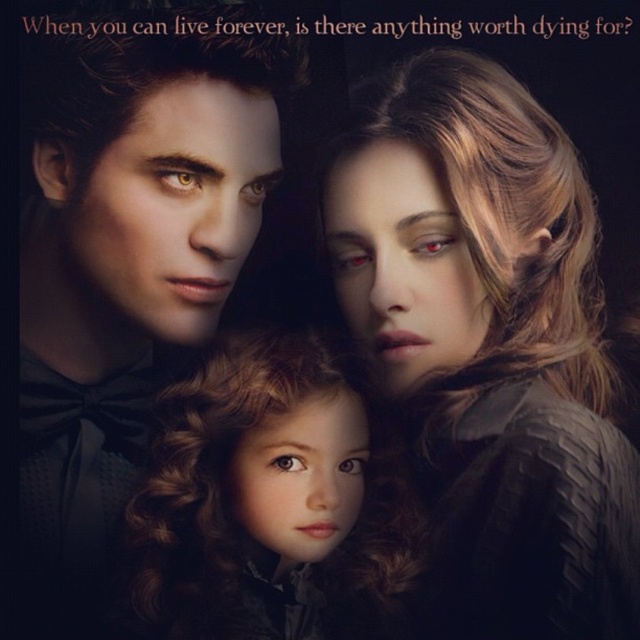
In the scene shown: You are a photographer setting up a shoot with the matte black suit at left and the curly brown hair doll at center. You want to position a spotlight so that it illuminates both subjects without casting shadows between them. Given their positions, where should you place the spotlight relative to the subjects?

The spotlight should be placed to the right of both the matte black suit at left and the curly brown hair doll at center. Since the matte black suit at left is to the left of the curly brown hair doll at center, positioning the spotlight to their right would ensure that light falls on both subjects and avoids casting shadows between them.

You are an artist trying to sketch the scene. You need to place the matte black suit at left in your drawing. What coordinates should you use for its position?

The matte black suit at left should be placed at coordinates (129, 253).

You are a photographer setting up a photo shoot with the scene described. You need to ensure the satin black dress at center and the curly brown hair doll at center are visible. Given their heights, which one should be placed closer to the front to avoid being obscured?

The curly brown hair doll at center should be placed closer to the front since it is shorter than the satin black dress at center, preventing it from being obscured by the taller dress.